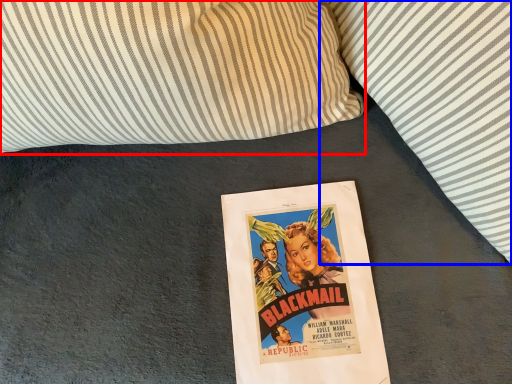
Question: Which point is closer to the camera, pillow (highlighted by a red box) or pillow (highlighted by a blue box)?

Choices:
 (A) pillow
 (B) pillow

Answer: (B)